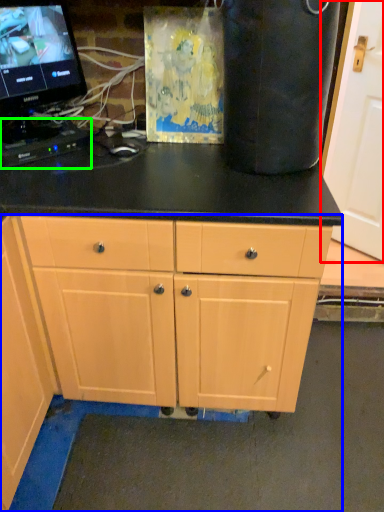
Question: Estimate the real-world distances between objects in this image. Which object is closer to door (highlighted by a red box), cabinet (highlighted by a blue box) or computer keyboard (highlighted by a green box)?

Choices:
 (A) cabinet
 (B) computer keyboard

Answer: (B)